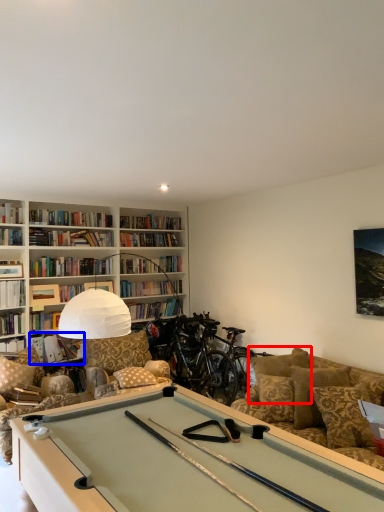
Question: Which object appears farthest to the camera in this image, pillow (highlighted by a red box) or book (highlighted by a blue box)?

Choices:
 (A) pillow
 (B) book

Answer: (B)